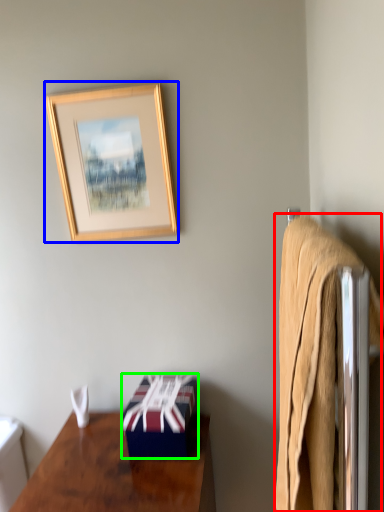
Question: Based on their relative distances, which object is farther from bath towel (highlighted by a red box)? Choose from picture frame (highlighted by a blue box) and box (highlighted by a green box).

Choices:
 (A) picture frame
 (B) box

Answer: (A)